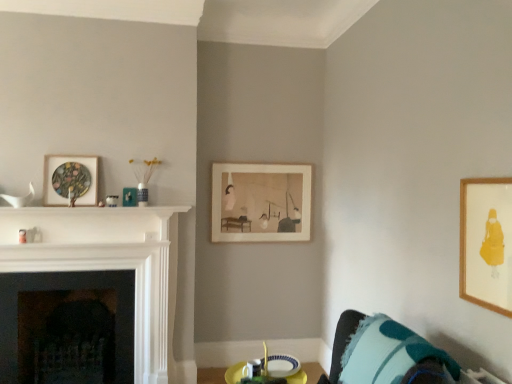
Question: Can we say wooden framed print at upper right, which is the third picture frame from back to front, lies outside matte wooden picture frame at upper left, arranged as the 2th picture frame when viewed from the front?

Choices:
 (A) no
 (B) yes

Answer: (B)

Question: Is wooden framed print at upper right, the 3th picture frame positioned from the left, thinner than matte wooden picture frame at upper left, acting as the third picture frame starting from the right?

Choices:
 (A) no
 (B) yes

Answer: (B)

Question: Considering the relative sizes of wooden framed print at upper right, which is the third picture frame from back to front, and matte wooden picture frame at upper left, placed as the second picture frame when sorted from back to front, in the image provided, is wooden framed print at upper right, which is the third picture frame from back to front, shorter than matte wooden picture frame at upper left, placed as the second picture frame when sorted from back to front,?

Choices:
 (A) yes
 (B) no

Answer: (B)

Question: From the image's perspective, does wooden framed print at upper right, which is counted as the first picture frame, starting from the right, appear higher than matte wooden picture frame at upper left, acting as the third picture frame starting from the right?

Choices:
 (A) no
 (B) yes

Answer: (A)

Question: From a real-world perspective, is wooden framed print at upper right, which is counted as the first picture frame, starting from the right, physically above matte wooden picture frame at upper left, arranged as the 2th picture frame when viewed from the front?

Choices:
 (A) yes
 (B) no

Answer: (B)

Question: Can matte wooden picture frame at upper left, acting as the third picture frame starting from the right, be found inside wooden framed print at upper right, which is the first picture frame from front to back?

Choices:
 (A) yes
 (B) no

Answer: (B)

Question: From the image's perspective, is black stone fireplace at left, placed as the 2th fireplace when sorted from front to back, on wooden framed print at upper right, which is counted as the first picture frame, starting from the right?

Choices:
 (A) no
 (B) yes

Answer: (A)

Question: Is black stone fireplace at left, placed as the 2th fireplace when sorted from front to back, smaller than wooden framed print at upper right, which is the third picture frame from back to front?

Choices:
 (A) no
 (B) yes

Answer: (A)

Question: Is black stone fireplace at left, placed as the 2th fireplace when sorted from front to back, at the left side of wooden framed print at upper right, the 3th picture frame positioned from the left?

Choices:
 (A) no
 (B) yes

Answer: (B)

Question: Does black stone fireplace at left, the first fireplace when ordered from back to front, have a greater height compared to wooden framed print at upper right, which is the first picture frame from front to back?

Choices:
 (A) yes
 (B) no

Answer: (A)

Question: Is black stone fireplace at left, placed as the 2th fireplace when sorted from front to back, next to wooden framed print at upper right, which is counted as the first picture frame, starting from the right, and touching it?

Choices:
 (A) yes
 (B) no

Answer: (B)

Question: Are black stone fireplace at left, the first fireplace when ordered from back to front, and wooden framed print at upper right, which is the third picture frame from back to front, far apart?

Choices:
 (A) no
 (B) yes

Answer: (B)

Question: Would you say white glossy fireplace at left, which ranks as the 1th fireplace in front-to-back order, is part of wooden framed print at upper right, which is the third picture frame from back to front,'s contents?

Choices:
 (A) yes
 (B) no

Answer: (B)